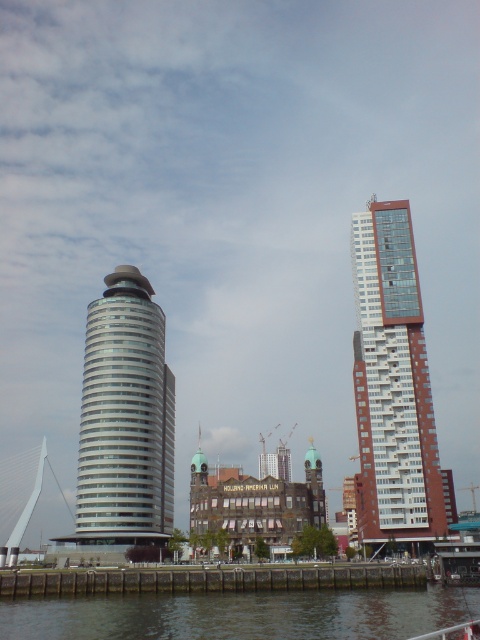
You are standing at the edge of the water in the urban landscape. The white glossy tower at center is your destination. If you can walk 100 meters in 5 minutes, will you reach the tower within that time?

The white glossy tower at center is 102.01 meters away from the viewer. Since you can walk 100 meters in 5 minutes, you will not reach the tower within that time as it is 2.01 meters farther than your walking distance.

You are standing in the urban landscape scene and want to determine which of the two points, point (375, 236) or point (264, 632), is closer to you. Based on the coordinates provided, which point is nearer?

Point (375, 236) is closer to you because it is further to the viewer than point (264, 632).